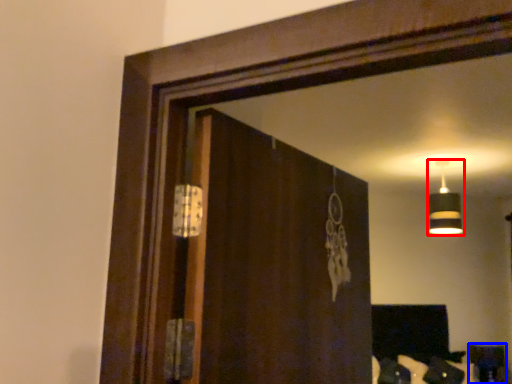
Question: Among these objects, which one is farthest to the camera, lamp (highlighted by a red box) or furniture (highlighted by a blue box)?

Choices:
 (A) lamp
 (B) furniture

Answer: (B)